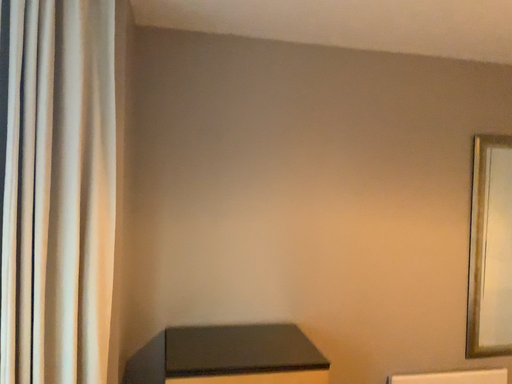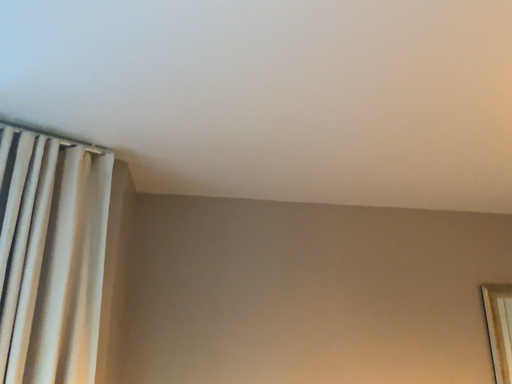
Question: How did the camera likely rotate when shooting the video?

Choices:
 (A) rotated upward
 (B) rotated downward

Answer: (A)